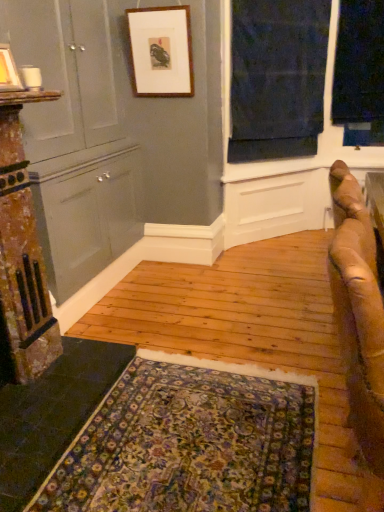
Find the location of a particular element. This screenshot has width=384, height=512. vacant space situated above wooden picture frame at upper center, the second picture frame ordered from the bottom (from a real-world perspective) is located at coordinates (155, 7).